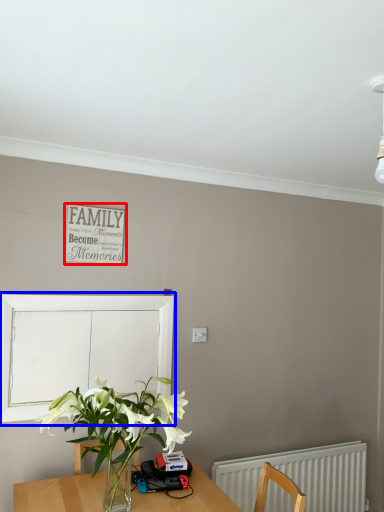
Question: Which point is further to the camera, bulletin board (highlighted by a red box) or window screen (highlighted by a blue box)?

Choices:
 (A) bulletin board
 (B) window screen

Answer: (A)